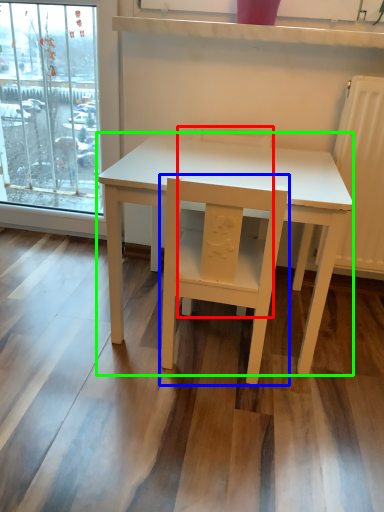
Question: Which object is positioned farthest from chair (highlighted by a red box)? Select from chair (highlighted by a blue box) and table (highlighted by a green box).

Choices:
 (A) chair
 (B) table

Answer: (A)